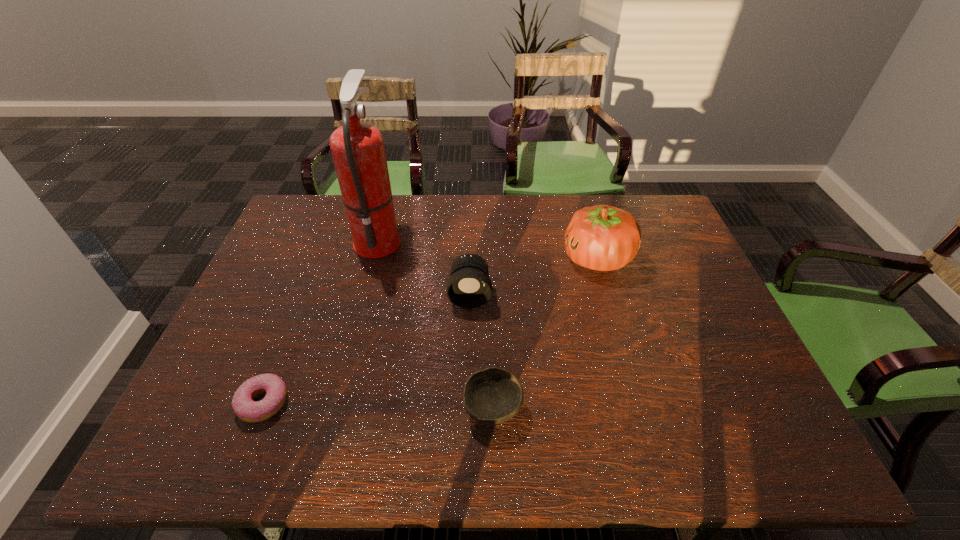
Where is `free location located 0.300m on the side of the rightmost object with the cute face`? free location located 0.300m on the side of the rightmost object with the cute face is located at coordinates (465, 258).

The width and height of the screenshot is (960, 540). Identify the location of blank space located 0.130m on the side of the rightmost object with the cute face. (520, 258).

Locate an element on the screen. The width and height of the screenshot is (960, 540). vacant space located 0.210m at the front element of the telephoto lens is located at coordinates (468, 375).

Find the location of a particular element. This screenshot has width=960, height=540. vacant space situated 0.300m on the back of the second shortest object is located at coordinates (491, 291).

Find the location of `vacant space located 0.160m on the right of the leftmost object`. vacant space located 0.160m on the right of the leftmost object is located at coordinates (359, 402).

The image size is (960, 540). Find the location of `fire extinguisher present at the far edge`. fire extinguisher present at the far edge is located at coordinates (358, 151).

At what (x,y) coordinates should I click in order to perform the action: click on pumpkin that is at the far edge. Please return your answer as a coordinate pair (x, y). Image resolution: width=960 pixels, height=540 pixels. Looking at the image, I should click on (604, 238).

You are a GUI agent. You are given a task and a screenshot of the screen. Output one action in this format:
    pyautogui.click(x=<x>, y=<y>)
    Task: Click on the bowl at the near edge
    The width and height of the screenshot is (960, 540).
    Given the screenshot: What is the action you would take?
    [491, 396]

At what (x,y) coordinates should I click in order to perform the action: click on doughnut at the near edge. Please return your answer as a coordinate pair (x, y). The width and height of the screenshot is (960, 540). Looking at the image, I should click on (244, 407).

Find the location of a particular element. The image size is (960, 540). object present at the left edge is located at coordinates (244, 407).